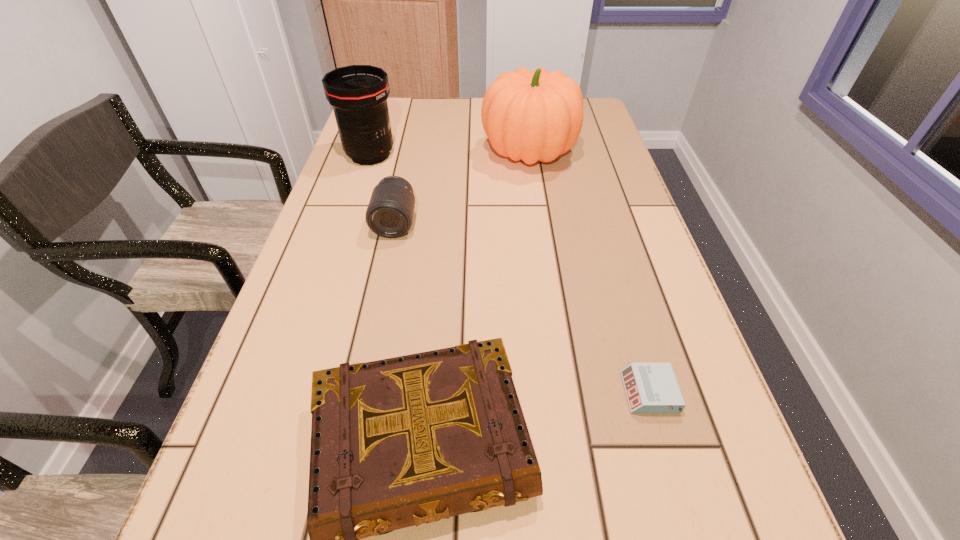
Where is `pumpkin`? The image size is (960, 540). pumpkin is located at coordinates (535, 116).

Identify the location of the farther telephoto lens. This screenshot has height=540, width=960. 358,93.

Identify the location of the third nearest object. This screenshot has height=540, width=960. (389, 214).

Identify the location of the nearer telephoto lens. This screenshot has height=540, width=960. (389, 214).

At what (x,y) coordinates should I click in order to perform the action: click on the shortest object. Please return your answer as a coordinate pair (x, y). Looking at the image, I should click on (651, 388).

You are a GUI agent. You are given a task and a screenshot of the screen. Output one action in this format:
    pyautogui.click(x=<x>, y=<y>)
    Task: Click on the free space located 0.160m on the left of the pumpkin
    
    Given the screenshot: What is the action you would take?
    pyautogui.click(x=424, y=153)

You are a GUI agent. You are given a task and a screenshot of the screen. Output one action in this format:
    pyautogui.click(x=<x>, y=<y>)
    Task: Click on the vacant space located on the front of the taller telephoto lens
    This screenshot has width=960, height=540.
    Given the screenshot: What is the action you would take?
    pyautogui.click(x=355, y=201)

Find the location of `free space located on the surface of the shorter telephoto lens`. free space located on the surface of the shorter telephoto lens is located at coordinates (387, 262).

This screenshot has height=540, width=960. Identify the location of free space located 0.130m on the left of the shortest object. (546, 392).

The width and height of the screenshot is (960, 540). I want to click on object positioned at the far edge, so click(x=535, y=116).